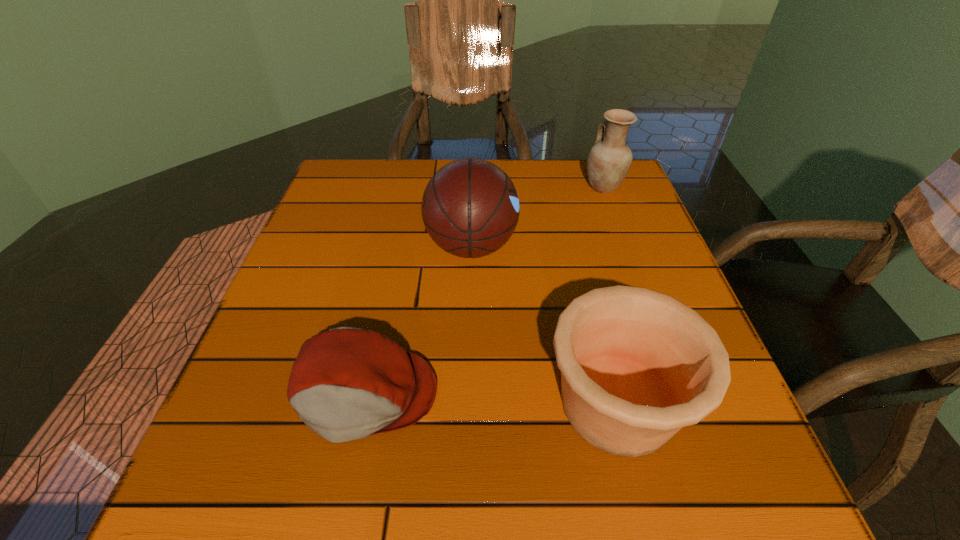
Where is `the third nearest object`? This screenshot has width=960, height=540. the third nearest object is located at coordinates (470, 208).

Where is `the farther pottery`? This screenshot has height=540, width=960. the farther pottery is located at coordinates (609, 161).

You are a GUI agent. You are given a task and a screenshot of the screen. Output one action in this format:
    pyautogui.click(x=<x>, y=<y>)
    Task: Click on the taller pottery
    
    Given the screenshot: What is the action you would take?
    pyautogui.click(x=609, y=161)

The height and width of the screenshot is (540, 960). Identify the location of the shorter pottery. (636, 365).

Locate an element on the screen. the third tallest object is located at coordinates (636, 365).

Where is `the shortest object`? The width and height of the screenshot is (960, 540). the shortest object is located at coordinates (347, 383).

The height and width of the screenshot is (540, 960). Identify the location of free space located on the left of the basketball. (372, 246).

Image resolution: width=960 pixels, height=540 pixels. I want to click on vacant point located 0.060m on the front of the taller pottery, so click(x=613, y=213).

Locate an element on the screen. free spot located on the left of the shorter pottery is located at coordinates (347, 403).

I want to click on free space located on the front-facing side of the cap, so click(x=342, y=511).